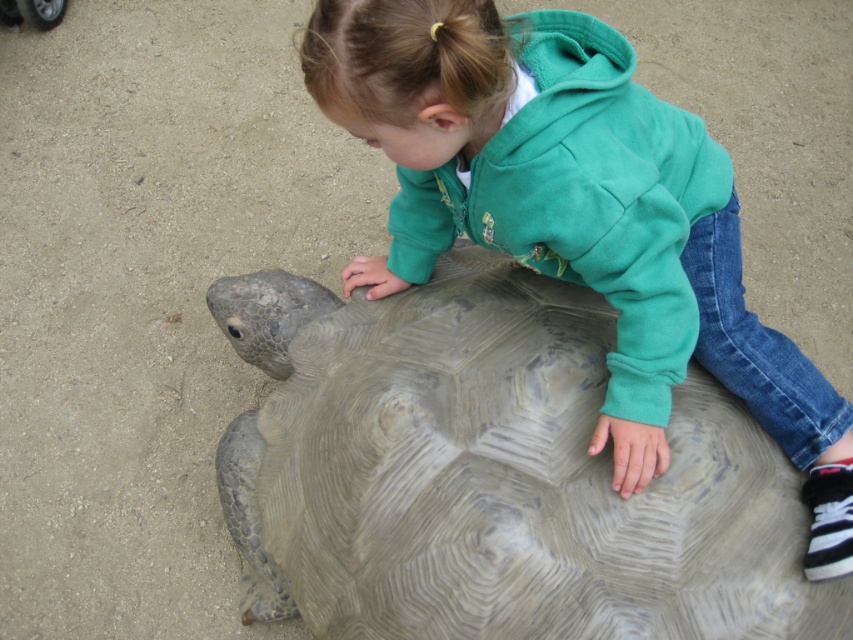
From the picture: Can you confirm if gray textured shell at center is thinner than green fleece jacket at upper center?

No, gray textured shell at center is not thinner than green fleece jacket at upper center.

Is point (514, 483) positioned behind point (631, 188)?

Yes, point (514, 483) is farther from viewer.

Is point (270, 294) positioned before point (566, 227)?

No, (270, 294) is behind (566, 227).

The height and width of the screenshot is (640, 853). I want to click on gray textured shell at center, so click(x=492, y=474).